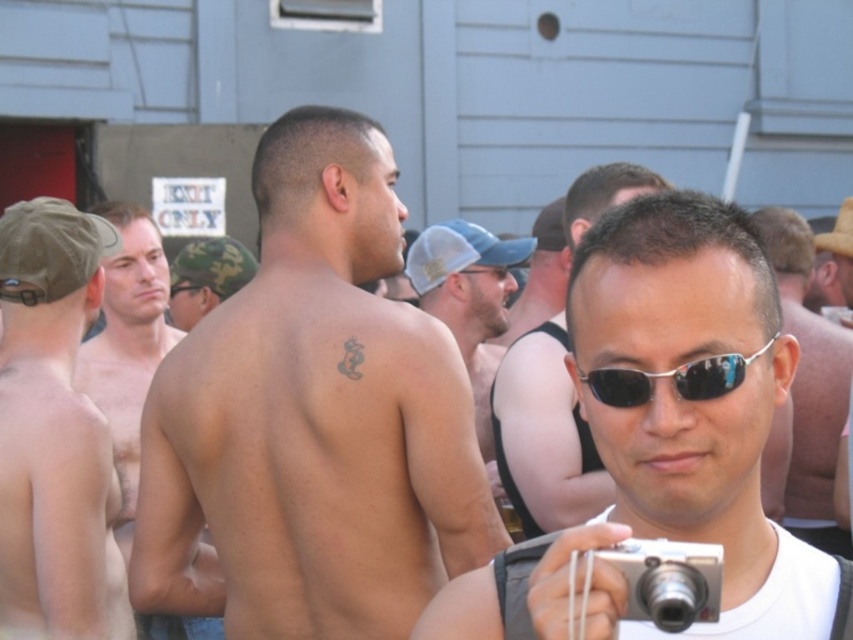
In the scene shown: You are a photographer at the event and want to capture a clear shot of the hairless skin at left without the silver metallic sunglasses at center blocking it. How should you adjust your camera angle?

The hairless skin at left is positioned under the silver metallic sunglasses at center, so you can lower your camera angle to capture the hairless skin at left without obstruction from the sunglasses.

What are the coordinates of the sunglasses at center?

The sunglasses at center is located at point (809, 385).